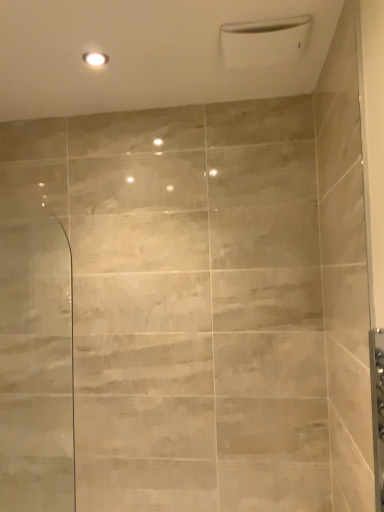
Describe the element at coordinates (95, 59) in the screenshot. I see `white glossy light fixture at upper center` at that location.

In order to click on white glossy light fixture at upper center in this screenshot , I will do `click(95, 59)`.

Where is `white glossy light fixture at upper center`? white glossy light fixture at upper center is located at coordinates (95, 59).